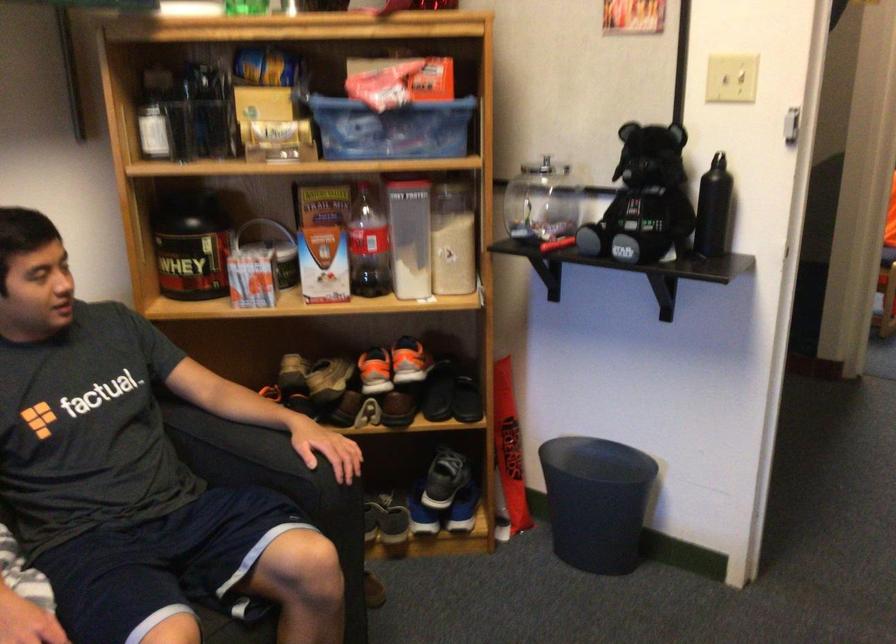
What do you see at coordinates (250, 455) in the screenshot? I see `the black sofa armrest` at bounding box center [250, 455].